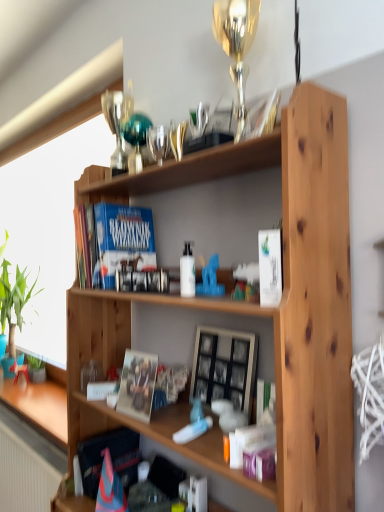
Question: From the image's perspective, is wooden picture frame at center located above or below green leafy plant at left, arranged as the 1th houseplant when viewed from the back?

Choices:
 (A) above
 (B) below

Answer: (B)

Question: From a real-world perspective, is wooden picture frame at center physically located above or below green leafy plant at left, which is the first houseplant in top-to-bottom order?

Choices:
 (A) above
 (B) below

Answer: (B)

Question: Which object is positioned farthest from the blue matte book at upper left, marked as the 1th paperback book in a back-to-front arrangement?

Choices:
 (A) green leafy plant at left, the second houseplant positioned from the right
 (B) green matte plant at lower left, placed as the 1th houseplant when sorted from front to back
 (C) wooden picture frame at center
 (D) white matte paperback book at center-right, acting as the second paperback book starting from the back
 (E) matte white coffee cup at lower left

Answer: (A)

Question: Estimate the real-world distances between objects in this image. Which object is farther from the blue matte book at upper left, the first paperback book in the left-to-right sequence?

Choices:
 (A) matte paper photo frame at center
 (B) green leafy plant at left, which appears as the second houseplant when ordered from the bottom
 (C) white matte paperback book at center-right, placed as the first paperback book when sorted from front to back
 (D) white glossy bottle at center
 (E) matte white coffee cup at lower left

Answer: (B)